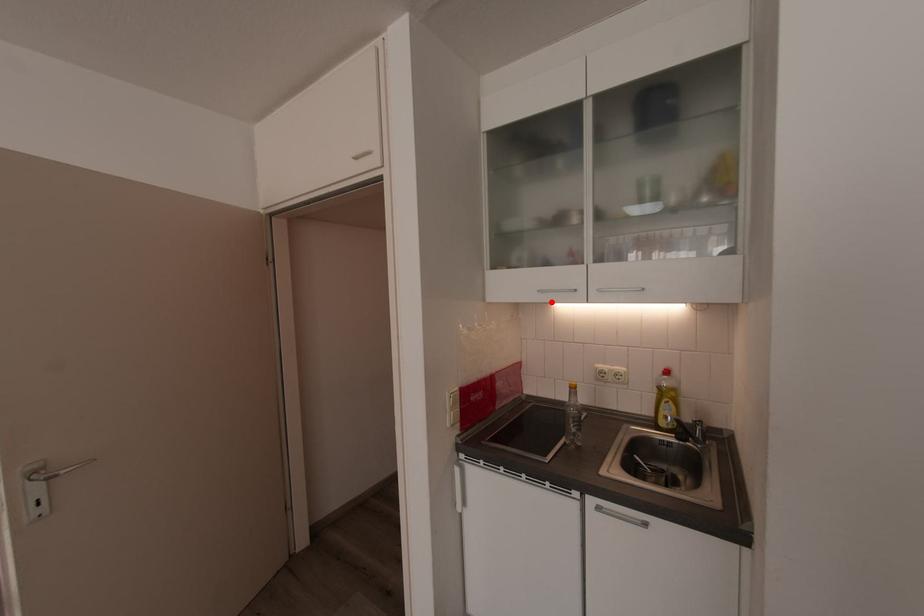
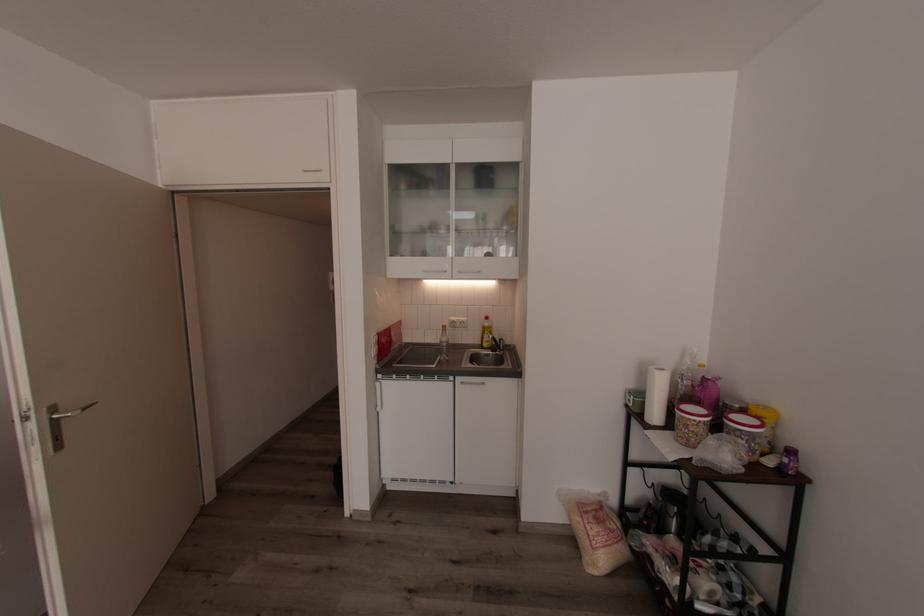
Find the pixel in the second image that matches the highlighted location in the first image.

(423, 280)